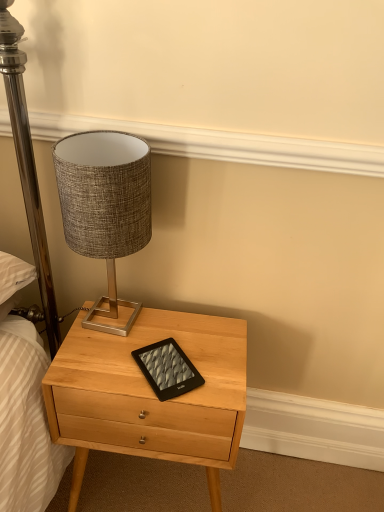
At what (x,y) coordinates should I click in order to perform the action: click on spots to the right of textured fabric lampshade at upper left. Please return your answer as a coordinate pair (x, y). This screenshot has height=512, width=384. Looking at the image, I should click on (182, 330).